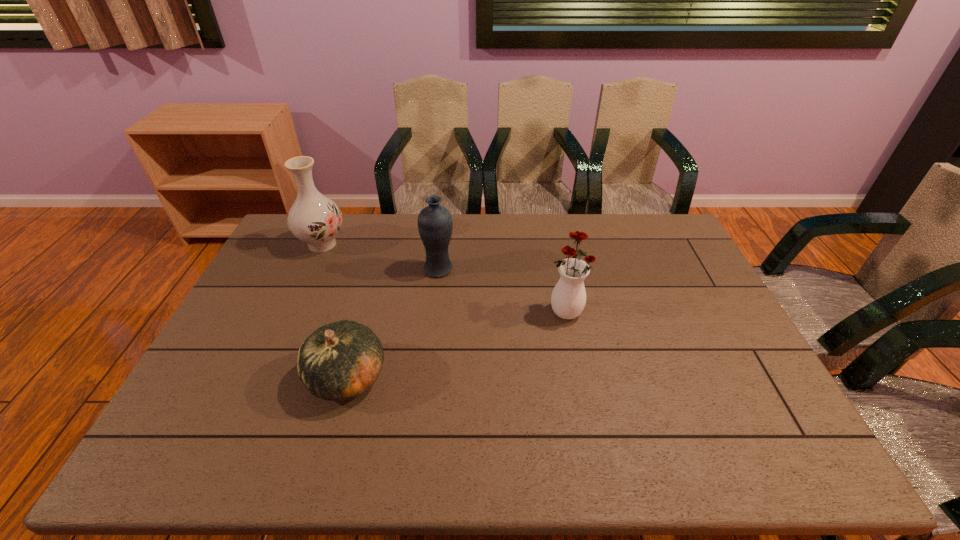
I want to click on free space located 0.350m on the back of the gourd, so click(377, 266).

Where is `object situated at the far edge`? This screenshot has height=540, width=960. object situated at the far edge is located at coordinates (315, 219).

The image size is (960, 540). What are the coordinates of `object at the left edge` in the screenshot? It's located at (315, 219).

Where is `object positioned at the far left corner`? This screenshot has height=540, width=960. object positioned at the far left corner is located at coordinates (315, 219).

Where is `free space at the far edge of the desktop`? This screenshot has width=960, height=540. free space at the far edge of the desktop is located at coordinates (402, 239).

This screenshot has height=540, width=960. In the image, there is a desktop. What are the coordinates of `free space at the left edge` in the screenshot? It's located at (286, 280).

Find the location of a particular element. vacant space at the right edge is located at coordinates (679, 283).

Where is `free space at the far left corner`? The width and height of the screenshot is (960, 540). free space at the far left corner is located at coordinates (286, 244).

Where is `unoccupied area between the second object from right to left and the nearest vase`? The width and height of the screenshot is (960, 540). unoccupied area between the second object from right to left and the nearest vase is located at coordinates (502, 291).

This screenshot has width=960, height=540. In order to click on free spot between the second vase from right to left and the gourd in this screenshot , I will do 393,323.